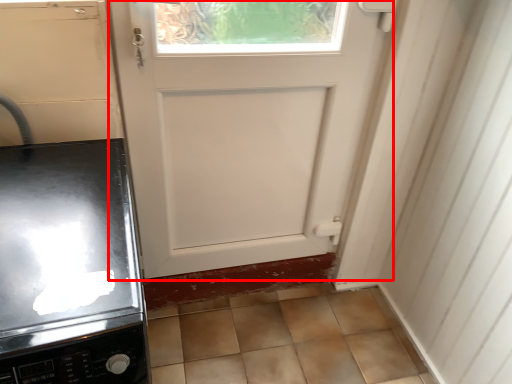
Question: From the image's perspective, what is the correct spatial positioning of door (annotated by the red box) in reference to home appliance?

Choices:
 (A) above
 (B) below

Answer: (A)